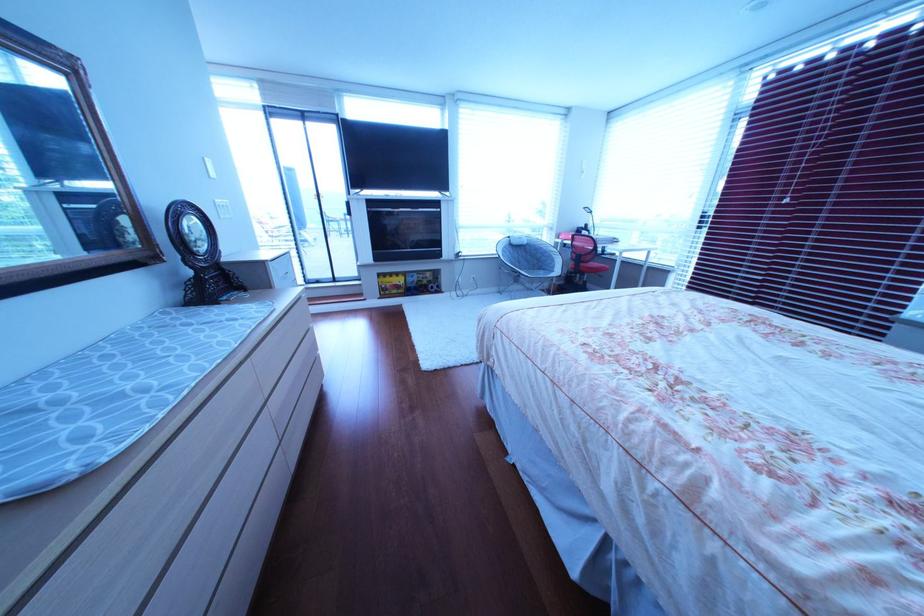
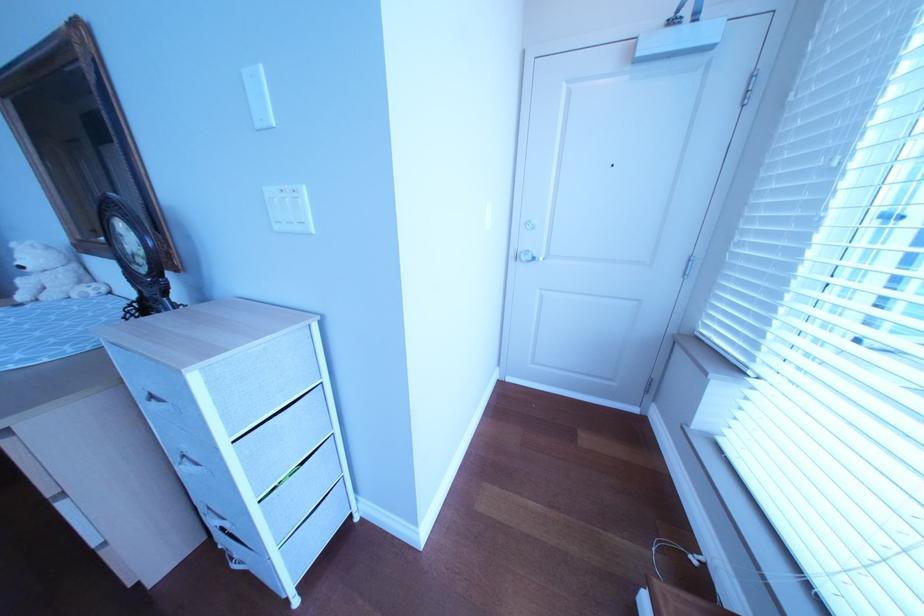
The point at (237, 217) is marked in the first image. Where is the corresponding point in the second image?

(292, 229)